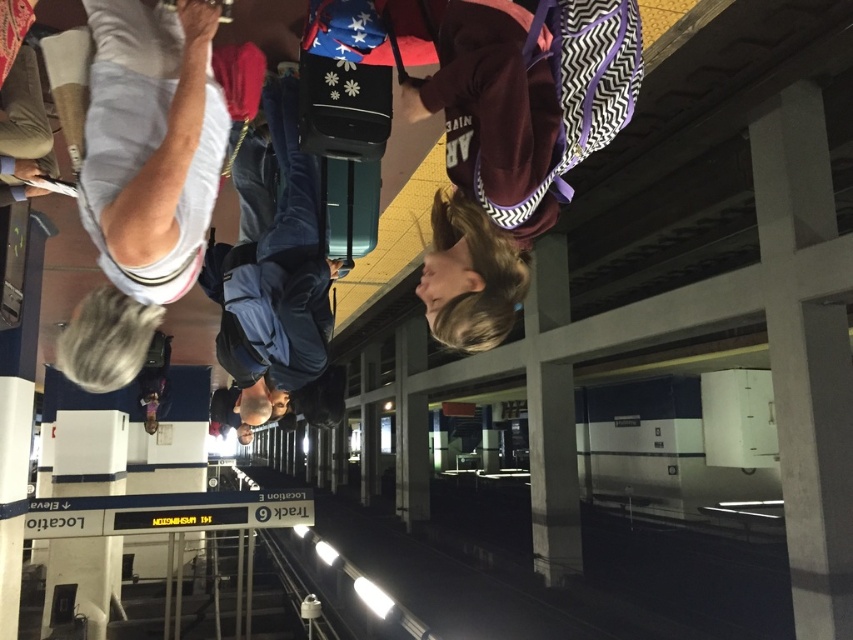
Who is positioned more to the left, white fabric shirt at upper left or dark blue fabric backpack at center?

dark blue fabric backpack at center

Does white fabric shirt at upper left appear on the right side of dark blue fabric backpack at center?

Yes, white fabric shirt at upper left is to the right of dark blue fabric backpack at center.

Is point (125, 269) behind point (306, 237)?

That is False.

You are a GUI agent. You are given a task and a screenshot of the screen. Output one action in this format:
    pyautogui.click(x=<x>, y=<y>)
    Task: Click on the white fabric shirt at upper left
    The width and height of the screenshot is (853, 640).
    Given the screenshot: What is the action you would take?
    pyautogui.click(x=143, y=177)